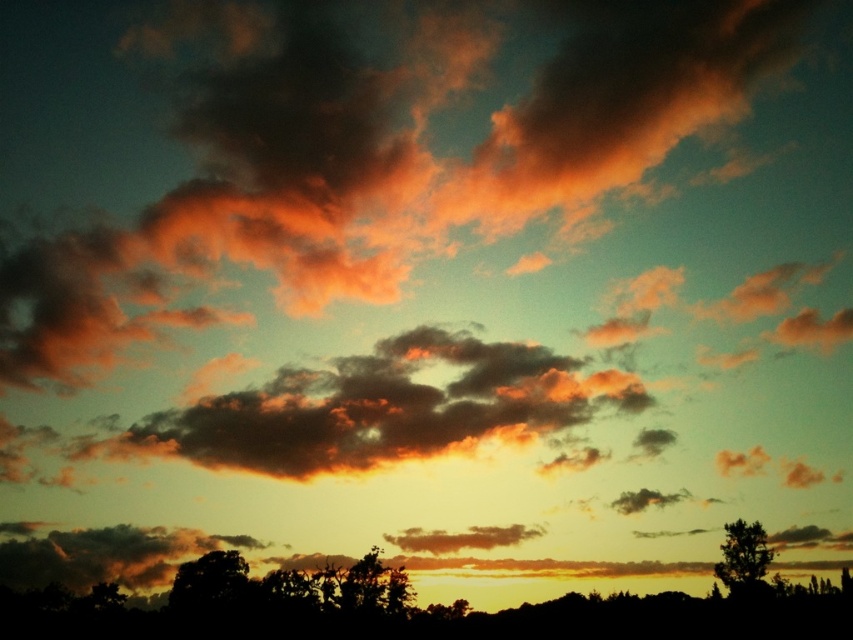
You are an artist trying to paint the sunset scene. You want to ensure the silhouette tree at lower right and the matte orange cloud at center are positioned correctly in terms of depth. Based on the scene, which object should appear in front of the other?

The silhouette tree at lower right should appear in front of the matte orange cloud at center because it is closer to the viewer.

From the picture: You are an ornithologist observing birds in the sunset scene. You notice a silhouette tree at lower right and a matte orange cloud at center. Which object is closer to you, the observer?

The silhouette tree at lower right is closer to you than the matte orange cloud at center because it is positioned lower in the image, which typically indicates proximity in such scenes.